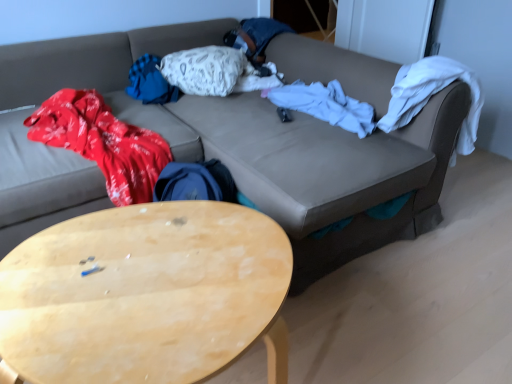
Question: From the image's perspective, would you say white soft blanket at center is shown under light wood/wooden coffee table at lower left?

Choices:
 (A) no
 (B) yes

Answer: (A)

Question: Does white soft blanket at center have a smaller size compared to light wood/wooden coffee table at lower left?

Choices:
 (A) yes
 (B) no

Answer: (A)

Question: From a real-world perspective, is white soft blanket at center on light wood/wooden coffee table at lower left?

Choices:
 (A) no
 (B) yes

Answer: (B)

Question: From the image's perspective, is white soft blanket at center over light wood/wooden coffee table at lower left?

Choices:
 (A) no
 (B) yes

Answer: (B)

Question: Is white soft blanket at center in front of light wood/wooden coffee table at lower left?

Choices:
 (A) no
 (B) yes

Answer: (A)

Question: From a real-world perspective, is white textured pillow at center physically located above or below white soft blanket at center?

Choices:
 (A) below
 (B) above

Answer: (B)

Question: Looking at their shapes, would you say white textured pillow at center is wider or thinner than white soft blanket at center?

Choices:
 (A) wide
 (B) thin

Answer: (A)

Question: Based on their sizes in the image, would you say white textured pillow at center is bigger or smaller than white soft blanket at center?

Choices:
 (A) big
 (B) small

Answer: (A)

Question: From the image's perspective, is white textured pillow at center located above or below white soft blanket at center?

Choices:
 (A) below
 (B) above

Answer: (B)

Question: Is white soft blanket at center to the left or to the right of white textured pillow at center in the image?

Choices:
 (A) right
 (B) left

Answer: (A)

Question: Do you think white soft blanket at center is within white textured pillow at center, or outside of it?

Choices:
 (A) outside
 (B) inside

Answer: (A)

Question: From the image's perspective, is white soft blanket at center positioned above or below white textured pillow at center?

Choices:
 (A) below
 (B) above

Answer: (A)

Question: Is white soft blanket at center wider or thinner than white textured pillow at center?

Choices:
 (A) thin
 (B) wide

Answer: (A)

Question: From a real-world perspective, is white textured pillow at center physically located above or below light wood/wooden coffee table at lower left?

Choices:
 (A) below
 (B) above

Answer: (B)

Question: Does point (199, 59) appear closer or farther from the camera than point (35, 329)?

Choices:
 (A) farther
 (B) closer

Answer: (A)